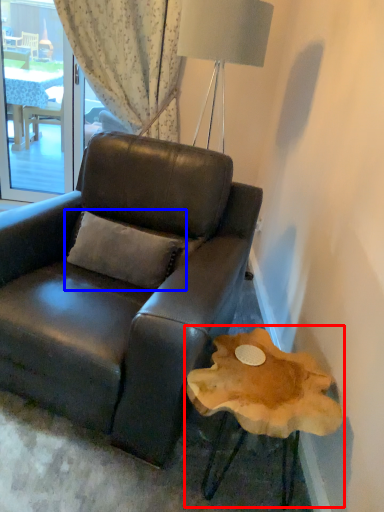
Question: Which object is closer to the camera taking this photo, round table (highlighted by a red box) or pillow (highlighted by a blue box)?

Choices:
 (A) round table
 (B) pillow

Answer: (A)